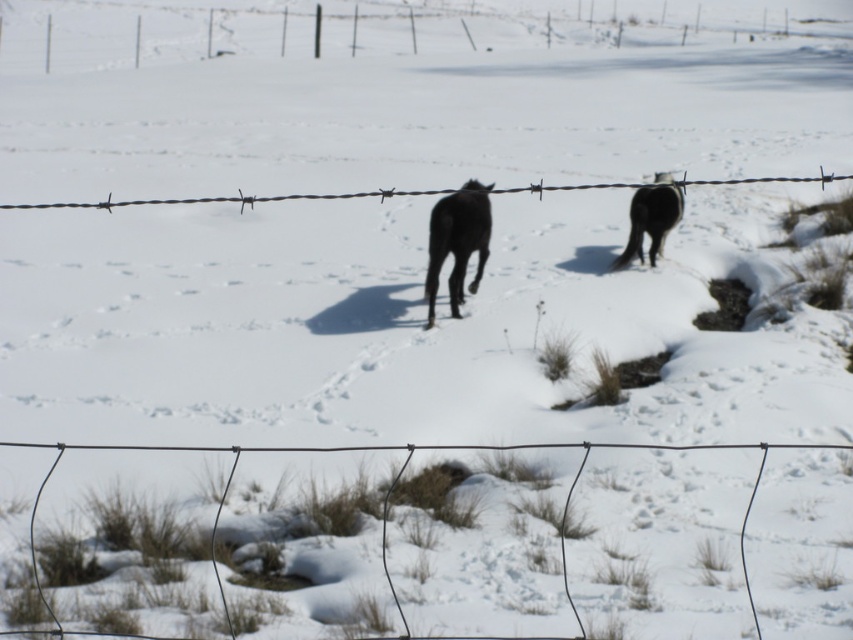
Does barbed wire at upper center have a greater height compared to wire mesh at center?

Correct, barbed wire at upper center is much taller as wire mesh at center.

I want to click on barbed wire at upper center, so click(x=146, y=29).

At what (x,y) coordinates should I click in order to perform the action: click on barbed wire at upper center. Please return your answer as a coordinate pair (x, y). The height and width of the screenshot is (640, 853). Looking at the image, I should click on (146, 29).

From the picture: Can you confirm if barbed wire at center is positioned to the left of black glossy horse at right?

Yes, barbed wire at center is to the left of black glossy horse at right.

Does point (138, 204) lie behind point (648, 227)?

Yes, it is behind point (648, 227).

Where is `barbed wire at center`? The image size is (853, 640). barbed wire at center is located at coordinates [229, 198].

Does barbed wire at upper center have a greater width compared to black glossy horse at right?

Indeed, barbed wire at upper center has a greater width compared to black glossy horse at right.

Measure the distance between barbed wire at upper center and black glossy horse at right.

The distance of barbed wire at upper center from black glossy horse at right is 101.93 feet.

At what (x,y) coordinates should I click in order to perform the action: click on barbed wire at upper center. Please return your answer as a coordinate pair (x, y). The height and width of the screenshot is (640, 853). Looking at the image, I should click on (146, 29).